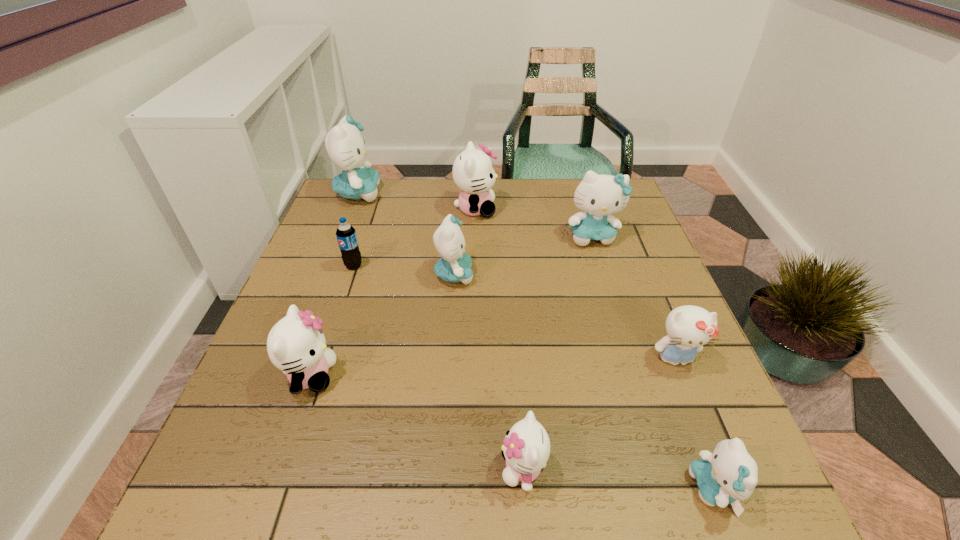
Where is `vacant space located 0.180m on the face of the nearest blue kitten`? This screenshot has width=960, height=540. vacant space located 0.180m on the face of the nearest blue kitten is located at coordinates (579, 489).

Locate an element on the screen. The width and height of the screenshot is (960, 540). vacant space situated on the face of the nearest blue kitten is located at coordinates (536, 489).

What are the coordinates of `free space located 0.170m on the face of the nearest blue kitten` in the screenshot? It's located at (586, 489).

Locate an element on the screen. Image resolution: width=960 pixels, height=540 pixels. soda bottle that is at the left edge is located at coordinates (346, 235).

I want to click on object that is at the far left corner, so click(x=346, y=148).

At what (x,y) coordinates should I click in order to perform the action: click on object that is at the near right corner. Please return your answer as a coordinate pair (x, y). The image size is (960, 540). Looking at the image, I should click on (729, 475).

Identify the location of vacant space at the far edge of the desktop. pos(434,203).

Identify the location of vacant region at the left edge. (244, 398).

You are a GUI agent. You are given a task and a screenshot of the screen. Output one action in this format:
    pyautogui.click(x=<x>, y=<y>)
    Task: Click on the vacant position at the far left corner of the desktop
    This screenshot has width=960, height=540.
    Given the screenshot: What is the action you would take?
    click(381, 201)

Where is `free space at the near left corner`? This screenshot has height=540, width=960. free space at the near left corner is located at coordinates pos(264,504).